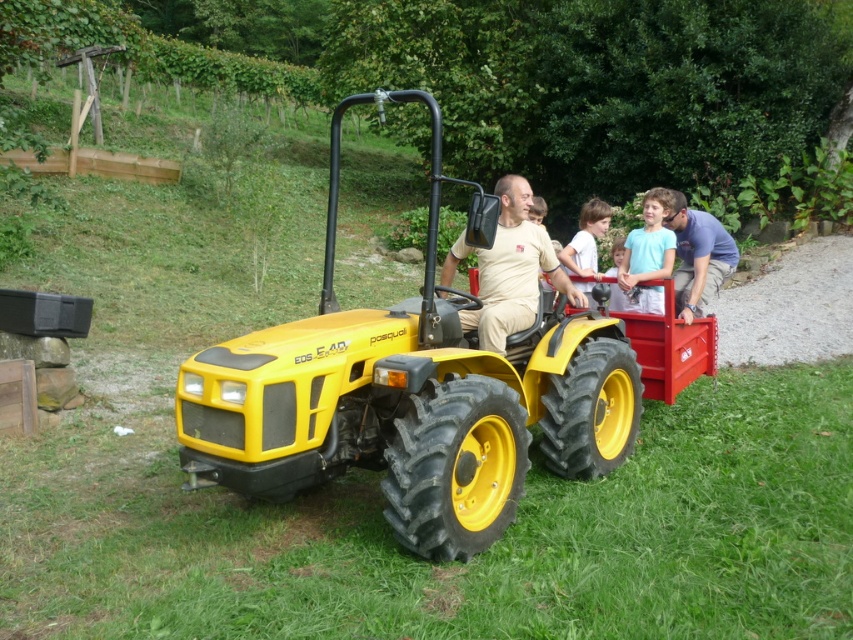
You are a photographer trying to capture a clear shot of both the matte beige shirt at center and the light blue fabric shirt at upper right. Since you want both subjects in focus, you need to adjust your camera to ensure depth of field. Which shirt should you focus on to make sure both are sharp?

You should focus on the matte beige shirt at center because it is closer to the viewer than the light blue fabric shirt at upper right. By focusing on the closer subject, the depth of field will extend further, increasing the likelihood that both shirts are in focus.

You are a photographer trying to capture a clear shot of the light blue fabric shirt at upper right and the light brown hair at center. Which object should you focus on first to ensure both are in focus, considering their heights?

The light blue fabric shirt at upper right is taller than the light brown hair at center. To ensure both are in focus, you should focus on the light blue fabric shirt at upper right first, as it is the taller object.

You are standing at the point labeled point (648,253) in the image. What object is located at this point?

The point (648,253) corresponds to the light blue fabric shirt at upper right.